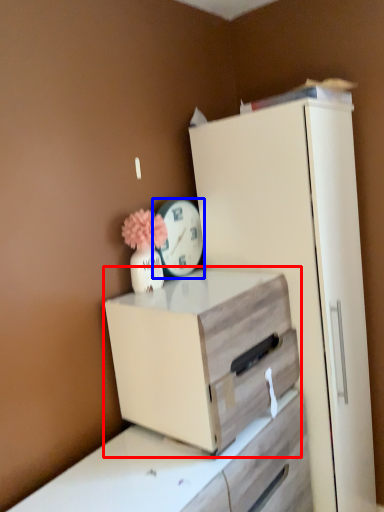
Question: Which point is closer to the camera, chest of drawers (highlighted by a red box) or clock (highlighted by a blue box)?

Choices:
 (A) chest of drawers
 (B) clock

Answer: (A)